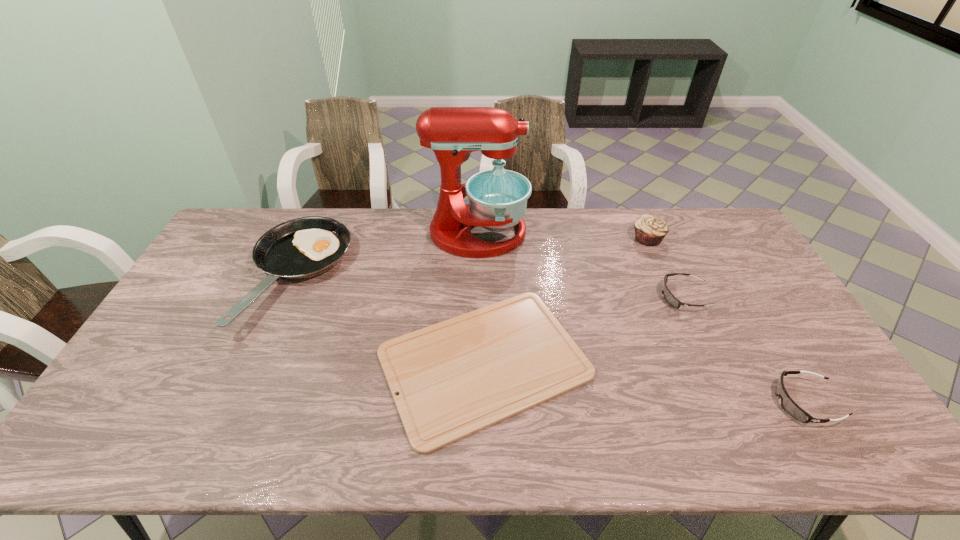
You are a GUI agent. You are given a task and a screenshot of the screen. Output one action in this format:
    pyautogui.click(x=<x>, y=<y>)
    Task: Click on the free region that satisfies the following two spatial constraints: 1. on the front-facing side of the mixer; 2. on the back side of the chopping board
    
    Given the screenshot: What is the action you would take?
    pyautogui.click(x=476, y=362)

You are a GUI agent. You are given a task and a screenshot of the screen. Output one action in this format:
    pyautogui.click(x=<x>, y=<y>)
    Task: Click on the vacant space that satisfies the following two spatial constraints: 1. on the front-facing side of the mixer; 2. on the left side of the fifth shortest object
    Image resolution: width=960 pixels, height=540 pixels.
    Given the screenshot: What is the action you would take?
    pyautogui.click(x=477, y=238)